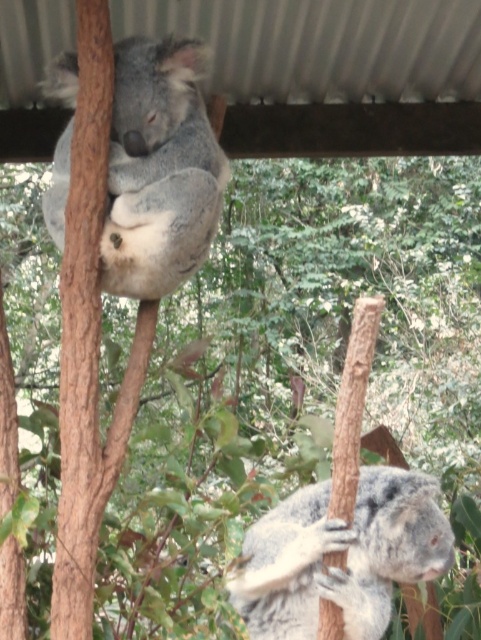
Question: Is gray furry koala at upper center below fuzzy gray koala at lower right?

Choices:
 (A) yes
 (B) no

Answer: (B)

Question: Which point is farther from the camera taking this photo?

Choices:
 (A) (419, 573)
 (B) (150, 164)

Answer: (B)

Question: Observing the image, what is the correct spatial positioning of gray furry koala at upper center in reference to fuzzy gray koala at lower right?

Choices:
 (A) left
 (B) right

Answer: (A)

Question: From the image, what is the correct spatial relationship of gray furry koala at upper center in relation to fuzzy gray koala at lower right?

Choices:
 (A) below
 (B) above

Answer: (B)